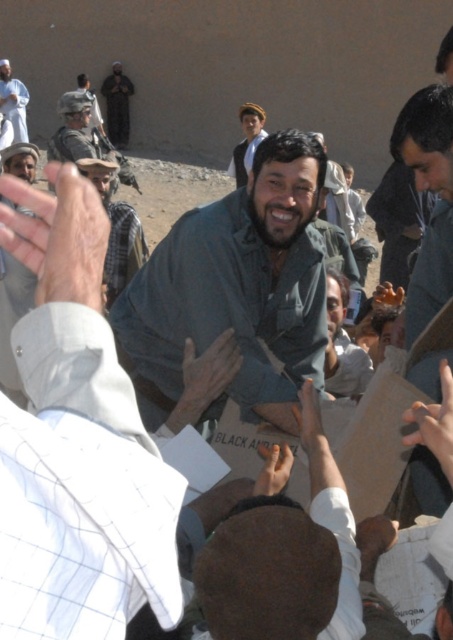
You are an observer at this event. You notice the light brown fabric hat at upper center and the white cotton shirt at upper left. Which one is closer to the ground?

The light brown fabric hat at upper center is shorter than the white cotton shirt at upper left, so it is closer to the ground.